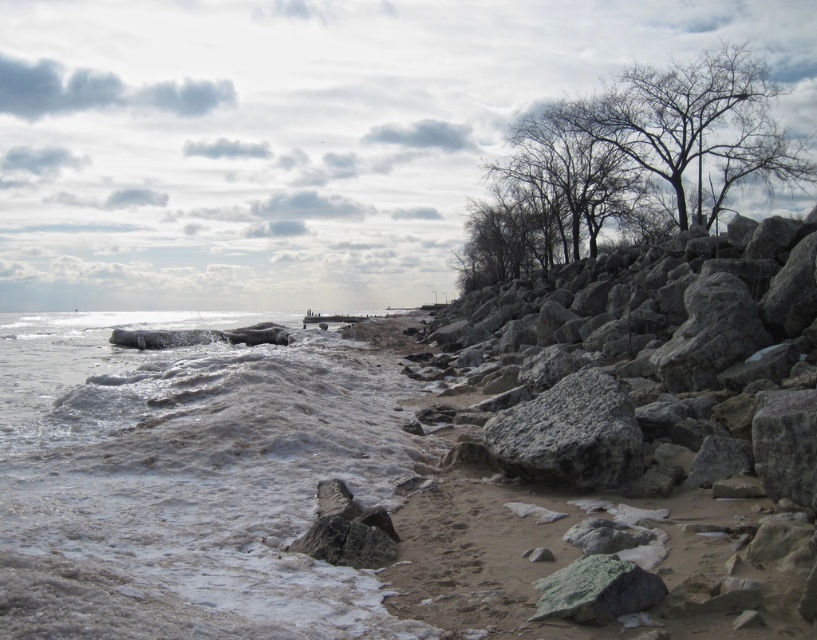
You are an artist planning to paint this coastal scene. You want to ensure the white frothy water at lower left and the bare branches at upper right are proportionally accurate. Which object should you make wider in your painting?

The white frothy water at lower left should be made wider in the painting since its width is larger than that of the bare branches at upper right according to the description.